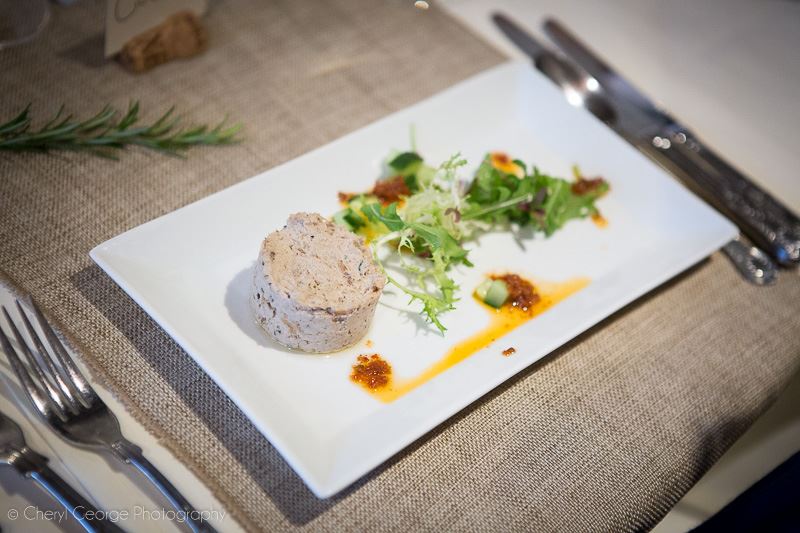
Locate an element on the screen. The height and width of the screenshot is (533, 800). rectangular white plate is located at coordinates (113, 249).